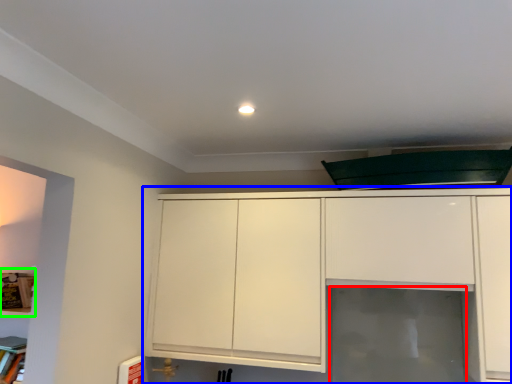
Question: Which is nearer to the glass door (highlighted by a red box)? cabinetry (highlighted by a blue box) or shelf (highlighted by a green box).

Choices:
 (A) cabinetry
 (B) shelf

Answer: (A)